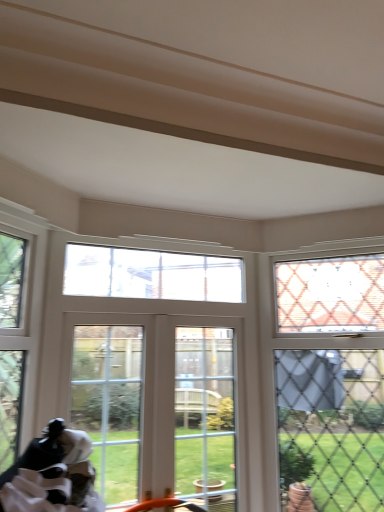
Question: Would you say clear glass window at center, the 2th window positioned from the left, is inside or outside clear glass door at center, which is the third window in left-to-right order?

Choices:
 (A) inside
 (B) outside

Answer: (B)

Question: Is point click(129, 296) closer or farther from the camera than point click(183, 424)?

Choices:
 (A) farther
 (B) closer

Answer: (A)

Question: Considering the real-world distances, which object is closest to the clear glass door at center, the second window when ordered from right to left?

Choices:
 (A) clear glass window at upper right, which is the 4th window from left to right
 (B) white glass door at center
 (C) clear glass window at upper left, which is the 1th window in left-to-right order
 (D) clear glass window at center, which is counted as the 3th window, starting from the right
 (E) clear glass door at center

Answer: (B)

Question: Estimate the real-world distances between objects in this image. Which object is farther from the clear glass door at center, the second window when ordered from right to left?

Choices:
 (A) clear glass door at center
 (B) clear glass window at upper left, placed as the 4th window when sorted from right to left
 (C) clear glass window at center, the 2th window positioned from the left
 (D) clear glass window at upper right, which is the 4th window from left to right
 (E) white glass door at center

Answer: (B)